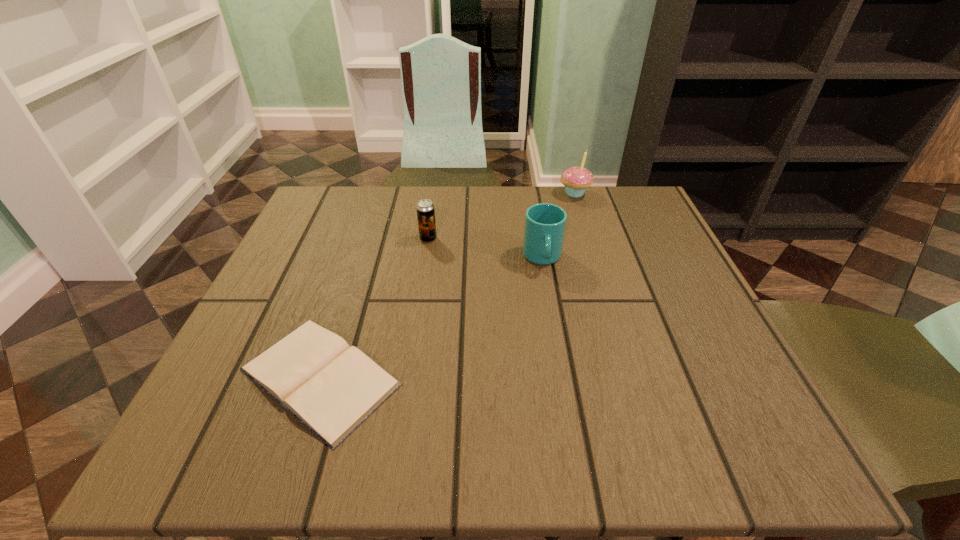
This screenshot has width=960, height=540. I want to click on cupcake located in the far edge section of the desktop, so click(x=576, y=180).

At what (x,y) coordinates should I click in order to perform the action: click on cup present at the far edge. Please return your answer as a coordinate pair (x, y). Looking at the image, I should click on (545, 223).

Image resolution: width=960 pixels, height=540 pixels. What are the coordinates of `beer can that is at the far edge` in the screenshot? It's located at (425, 209).

You are a GUI agent. You are given a task and a screenshot of the screen. Output one action in this format:
    pyautogui.click(x=<x>, y=<y>)
    Task: Click on the object that is at the near edge
    The height and width of the screenshot is (540, 960).
    Given the screenshot: What is the action you would take?
    pyautogui.click(x=330, y=387)

What are the coordinates of `object that is positioned at the left edge` in the screenshot? It's located at coord(330,387).

Where is `object positioned at the right edge`? The height and width of the screenshot is (540, 960). object positioned at the right edge is located at coordinates (576, 180).

Identify the location of object that is at the near left corner. The height and width of the screenshot is (540, 960). (330, 387).

Identify the location of object at the far right corner. The image size is (960, 540). pos(576,180).

In the image, there is a desktop. Where is `vacant space at the far edge`? This screenshot has height=540, width=960. vacant space at the far edge is located at coordinates (371, 234).

Locate an element on the screen. vacant space at the near edge of the desktop is located at coordinates (572, 406).